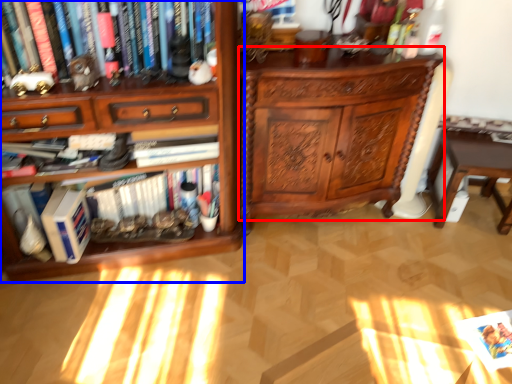
Question: Which point is further to the camera, chest of drawers (highlighted by a red box) or bookcase (highlighted by a blue box)?

Choices:
 (A) chest of drawers
 (B) bookcase

Answer: (A)